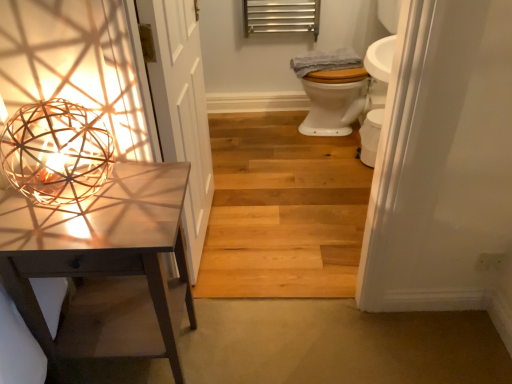
Identify the location of matte white table at left. The height and width of the screenshot is (384, 512). (104, 265).

The width and height of the screenshot is (512, 384). I want to click on woven wood sphere at left, so click(x=56, y=152).

This screenshot has width=512, height=384. What do you see at coordinates (282, 210) in the screenshot? I see `natural wood floor at center` at bounding box center [282, 210].

In order to click on gray cotton towel at upper right in this screenshot , I will do `click(325, 61)`.

I want to click on metallic silver radiator at upper center, so click(281, 16).

Looking at this image, is metallic silver radiator at upper center not inside natural wood floor at center?

metallic silver radiator at upper center is positioned outside natural wood floor at center.

From a real-world perspective, is metallic silver radiator at upper center above or below natural wood floor at center?

metallic silver radiator at upper center is above natural wood floor at center.

Is metallic silver radiator at upper center further to the viewer compared to natural wood floor at center?

Yes, it is.

Considering the sizes of white glossy toilet bowl at center and metallic silver radiator at upper center in the image, is white glossy toilet bowl at center bigger or smaller than metallic silver radiator at upper center?

Clearly, white glossy toilet bowl at center is smaller in size than metallic silver radiator at upper center.

From a real-world perspective, is white glossy toilet bowl at center physically located above or below metallic silver radiator at upper center?

Clearly, from a real-world perspective, white glossy toilet bowl at center is below metallic silver radiator at upper center.

In the scene shown: Does white glossy toilet bowl at center have a lesser width compared to metallic silver radiator at upper center?

No.

Does white wood door at left lie in front of gray cotton towel at upper right?

Yes, white wood door at left is closer to the viewer.

Is white wood door at left turned away from gray cotton towel at upper right?

white wood door at left does not have its back to gray cotton towel at upper right.

Does point (196, 143) come behind point (329, 56)?

No.

Looking at this image, in terms of height, does natural wood floor at center look taller or shorter compared to white wood door at left?

natural wood floor at center is shorter than white wood door at left.

Between point (260, 243) and point (164, 62), which one is positioned in front?

The point (164, 62) is closer to the camera.

In the image, is natural wood floor at center positioned in front of or behind white wood door at left?

natural wood floor at center is positioned farther from the viewer than white wood door at left.

From a real-world perspective, is natural wood floor at center located higher than white wood door at left?

No, from a real-world perspective, natural wood floor at center is not above white wood door at left.

From the image's perspective, who appears lower, gray cotton towel at upper right or metallic silver radiator at upper center?

gray cotton towel at upper right, from the image's perspective.

Measure the distance between gray cotton towel at upper right and metallic silver radiator at upper center.

gray cotton towel at upper right is 13.05 inches from metallic silver radiator at upper center.

From the picture: Is metallic silver radiator at upper center at the back of gray cotton towel at upper right?

No.

Is point (318, 51) behind point (257, 1)?

Yes, it is.

Which is closer to the camera, [173,8] or [73,129]?

The point [73,129] is in front.

Is white wood door at left closer to the viewer compared to woven wood sphere at left?

No, white wood door at left is further to the viewer.

Which of these two, white wood door at left or woven wood sphere at left, stands shorter?

With less height is woven wood sphere at left.

Is white wood door at left to the left of woven wood sphere at left from the viewer's perspective?

No.

In the scene shown: Between gray cotton towel at upper right and matte white table at left, which one has larger width?

gray cotton towel at upper right is wider.

Can you confirm if gray cotton towel at upper right is smaller than matte white table at left?

Indeed, gray cotton towel at upper right has a smaller size compared to matte white table at left.

Can you tell me how much gray cotton towel at upper right and matte white table at left differ in facing direction?

They differ by 83 degrees in their facing directions.

Based on the photo, is gray cotton towel at upper right completely or partially outside of matte white table at left?

Indeed, gray cotton towel at upper right is completely outside matte white table at left.

I want to click on stairwell located underneath the metallic silver radiator at upper center (from a real-world perspective), so click(x=282, y=210).

Where is `shutter above the white glossy toilet bowl at center (from the image's perspective)`? The height and width of the screenshot is (384, 512). shutter above the white glossy toilet bowl at center (from the image's perspective) is located at coordinates (281, 16).

Considering their positions, is woven wood sphere at left positioned closer to natural wood floor at center than matte white table at left?

matte white table at left.

When comparing their distances from woven wood sphere at left, does gray cotton towel at upper right or matte white table at left seem further?

gray cotton towel at upper right is positioned further to the anchor woven wood sphere at left.

Estimate the real-world distances between objects in this image. Which object is closer to white wood door at left, gray cotton towel at upper right or white glossy toilet bowl at center?

Based on the image, white glossy toilet bowl at center appears to be nearer to white wood door at left.

Based on their spatial positions, is gray cotton towel at upper right or white glossy toilet bowl at center further from metallic silver radiator at upper center?

white glossy toilet bowl at center.

Looking at the image, which one is located further to matte white table at left, white wood door at left or white glossy toilet bowl at center?

white glossy toilet bowl at center is further to matte white table at left.

When comparing their distances from gray cotton towel at upper right, does white glossy toilet bowl at center or white wood door at left seem further?

Among the two, white wood door at left is located further to gray cotton towel at upper right.

Looking at the image, which one is located closer to gray cotton towel at upper right, woven wood sphere at left or white glossy toilet bowl at center?

white glossy toilet bowl at center is closer to gray cotton towel at upper right.

When comparing their distances from metallic silver radiator at upper center, does woven wood sphere at left or white wood door at left seem further?

woven wood sphere at left is further to metallic silver radiator at upper center.

Find the location of `table between woven wood sphere at left and white glossy toilet bowl at center along the z-axis`. table between woven wood sphere at left and white glossy toilet bowl at center along the z-axis is located at coordinates (104, 265).

What are the coordinates of `material between metallic silver radiator at upper center and white glossy toilet bowl at center in the vertical direction` in the screenshot? It's located at (325, 61).

Image resolution: width=512 pixels, height=384 pixels. Find the location of `door positioned between woven wood sphere at left and natural wood floor at center from near to far`. door positioned between woven wood sphere at left and natural wood floor at center from near to far is located at coordinates (181, 109).

The image size is (512, 384). What are the coordinates of `door between matte white table at left and metallic silver radiator at upper center along the z-axis` in the screenshot? It's located at 181,109.